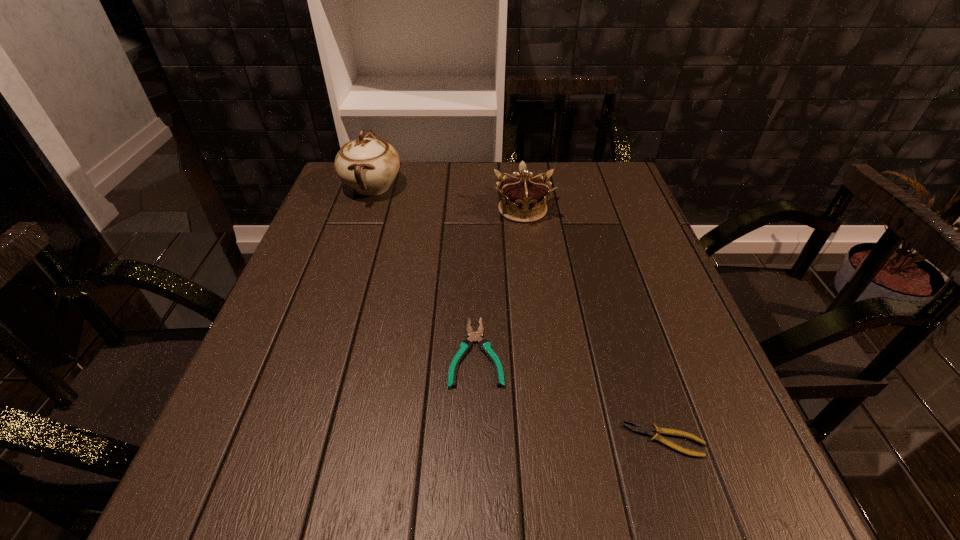
The width and height of the screenshot is (960, 540). I want to click on vacant space located on the left of the rightmost object, so [x=582, y=440].

You are a GUI agent. You are given a task and a screenshot of the screen. Output one action in this format:
    pyautogui.click(x=<x>, y=<y>)
    Task: Click on the chinaware that is at the far edge
    
    Given the screenshot: What is the action you would take?
    pyautogui.click(x=368, y=165)

The image size is (960, 540). In order to click on crown that is at the far edge in this screenshot , I will do `click(523, 197)`.

You are a GUI agent. You are given a task and a screenshot of the screen. Output one action in this format:
    pyautogui.click(x=<x>, y=<y>)
    Task: Click on the object at the left edge
    
    Given the screenshot: What is the action you would take?
    pyautogui.click(x=368, y=165)

What are the coordinates of `object situated at the right edge` in the screenshot? It's located at (643, 429).

This screenshot has height=540, width=960. Find the location of `object located in the far left corner section of the desktop`. object located in the far left corner section of the desktop is located at coordinates coord(368,165).

Identify the location of vacant space at the far edge. (415, 187).

The height and width of the screenshot is (540, 960). I want to click on vacant area at the left edge of the desktop, so click(x=327, y=259).

At what (x,y) coordinates should I click in order to perform the action: click on vacant space at the right edge. Please return your answer as a coordinate pair (x, y). The width and height of the screenshot is (960, 540). Looking at the image, I should click on (602, 281).

Image resolution: width=960 pixels, height=540 pixels. Identify the location of blank space at the far right corner. (577, 187).